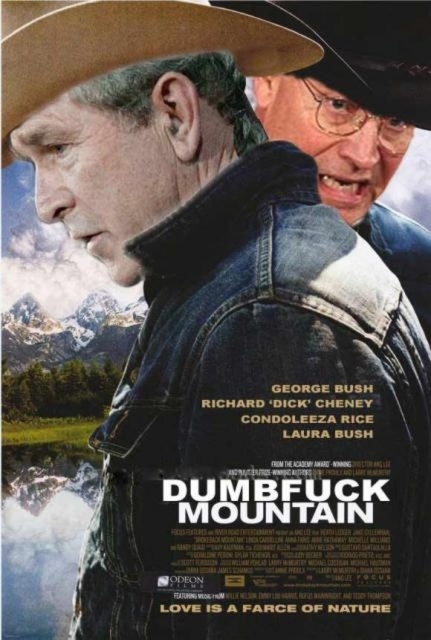
Between point (194, 506) and point (218, 22), which one is positioned in front?

Point (194, 506) is more forward.

Who is taller, denim jacket at center or brown felt cowboy hat at upper left?

With more height is denim jacket at center.

Which is behind, point (311, 308) or point (18, 40)?

The point (18, 40) is behind.

This screenshot has width=431, height=640. I want to click on denim jacket at center, so click(x=264, y=429).

Does denim jacket at center have a lesser height compared to brown leather cowboy hat at upper center?

No.

Is point (216, 522) behind point (349, 12)?

No, it is in front of (349, 12).

What do you see at coordinates (264, 429) in the screenshot? I see `denim jacket at center` at bounding box center [264, 429].

Locate an element on the screen. Image resolution: width=431 pixels, height=640 pixels. denim jacket at center is located at coordinates (264, 429).

Can you confirm if brown felt cowboy hat at upper left is positioned above brown leather cowboy hat at upper center?

Incorrect, brown felt cowboy hat at upper left is not positioned above brown leather cowboy hat at upper center.

Does brown felt cowboy hat at upper left lie behind brown leather cowboy hat at upper center?

No.

The width and height of the screenshot is (431, 640). What do you see at coordinates (124, 44) in the screenshot?
I see `brown felt cowboy hat at upper left` at bounding box center [124, 44].

In order to click on brown felt cowboy hat at upper left in this screenshot , I will do `click(124, 44)`.